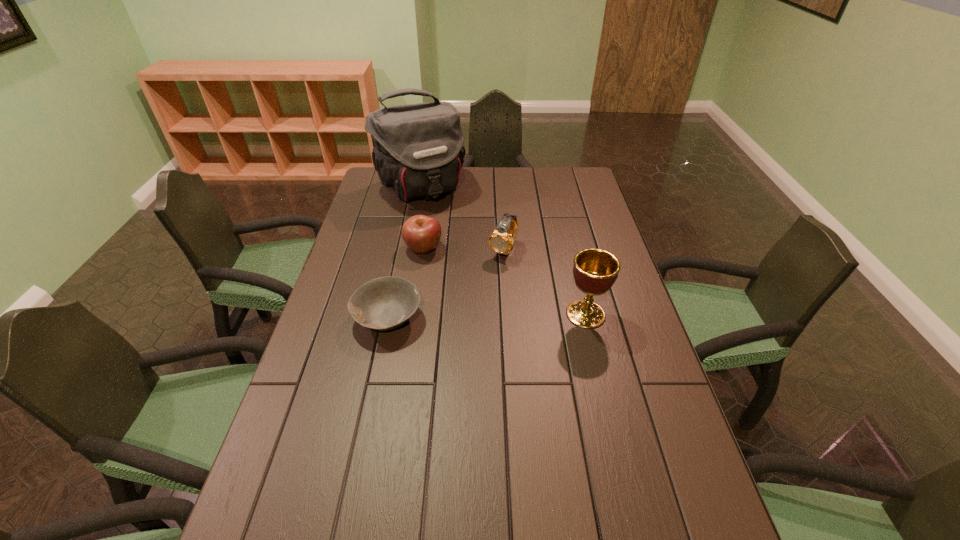
Find the location of a particular element. This screenshot has height=540, width=960. vacant space situated on the face of the third tallest object is located at coordinates (448, 342).

In order to click on vacant space located 0.380m on the face of the third tallest object in this screenshot , I will do `click(447, 345)`.

Locate an element on the screen. vacant space located on the face of the third tallest object is located at coordinates (444, 350).

Locate an element on the screen. The width and height of the screenshot is (960, 540). free spot located on the open flap of the farthest object is located at coordinates (458, 246).

The width and height of the screenshot is (960, 540). What are the coordinates of `vacant space located on the open flap of the farthest object` in the screenshot? It's located at (449, 232).

Locate an element on the screen. free location located on the open flap of the farthest object is located at coordinates (463, 255).

Image resolution: width=960 pixels, height=540 pixels. I want to click on vacant area situated on the side of the fourth tallest object with the unique marking, so (479, 297).

You are a GUI agent. You are given a task and a screenshot of the screen. Output one action in this format:
    pyautogui.click(x=<x>, y=<y>)
    Task: Click on the free location located 0.370m on the side of the fourth tallest object with the unique marking
    The image size is (960, 540).
    Given the screenshot: What is the action you would take?
    pyautogui.click(x=508, y=322)

You are a GUI agent. You are given a task and a screenshot of the screen. Output one action in this format:
    pyautogui.click(x=<x>, y=<y>)
    Task: Click on the free space located on the side of the fourth tallest object with the unique marking
    Image resolution: width=960 pixels, height=540 pixels.
    Given the screenshot: What is the action you would take?
    pyautogui.click(x=492, y=308)

Where is `object situated at the far edge`? The width and height of the screenshot is (960, 540). object situated at the far edge is located at coordinates (418, 151).